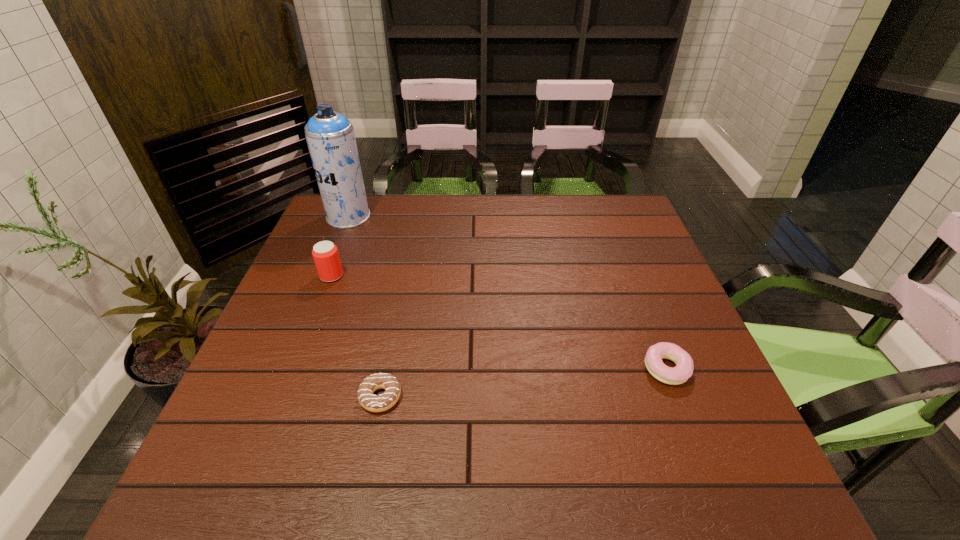
What are the coordinates of `aerosol can` in the screenshot? It's located at (330, 136).

This screenshot has height=540, width=960. In order to click on the farthest object in this screenshot , I will do `click(330, 136)`.

This screenshot has width=960, height=540. Identify the location of the second tallest object. (325, 254).

What are the coordinates of `the third nearest object` in the screenshot? It's located at (325, 254).

Find the location of a particular element. the right doughnut is located at coordinates (684, 368).

Where is `the shortest object`? The height and width of the screenshot is (540, 960). the shortest object is located at coordinates (386, 400).

Where is `the shorter doughnut`? The image size is (960, 540). the shorter doughnut is located at coordinates (386, 400).

Find the location of a particular element. vacant space situated on the right of the farthest object is located at coordinates (426, 217).

Locate an element on the screen. This screenshot has width=960, height=540. free region located on the right of the third nearest object is located at coordinates (446, 275).

At what (x,y) coordinates should I click in order to perform the action: click on free space located on the left of the right doughnut. Please return your answer as a coordinate pair (x, y). The image size is (960, 540). Looking at the image, I should click on (496, 369).